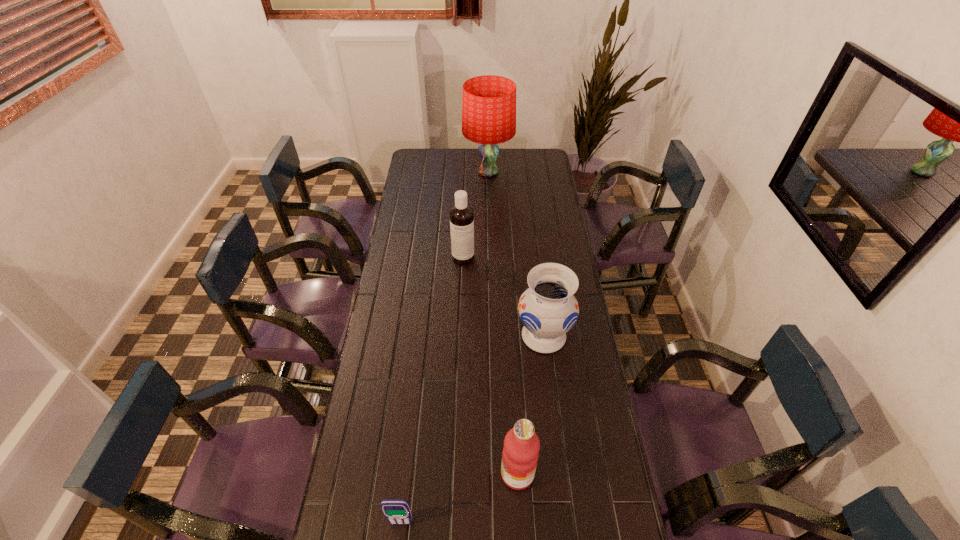
Identify the location of lampshade. (489, 102).

Where is `the tallest object`? Image resolution: width=960 pixels, height=540 pixels. the tallest object is located at coordinates (x=489, y=102).

The image size is (960, 540). Identify the location of the fourth nearest object. (461, 214).

You are a GUI agent. You are given a task and a screenshot of the screen. Output one action in this format:
    pyautogui.click(x=<x>, y=<y>)
    Task: Click on the vase
    The image size is (960, 540).
    Given the screenshot: What is the action you would take?
    pyautogui.click(x=548, y=309)

This screenshot has height=540, width=960. In order to click on fruit juice in this screenshot , I will do `click(521, 447)`.

Identify the location of the nearest object. The image size is (960, 540). (396, 511).

Image resolution: width=960 pixels, height=540 pixels. In order to click on the leftmost object in this screenshot , I will do `click(396, 511)`.

I want to click on free space located on the front-facing side of the lampshade, so click(x=490, y=225).

In order to click on vacant space located 0.280m on the label side of the fourth nearest object in this screenshot , I will do `click(461, 316)`.

Locate an element on the screen. This screenshot has height=540, width=960. vacant space located 0.180m on the front of the third farthest object is located at coordinates (552, 407).